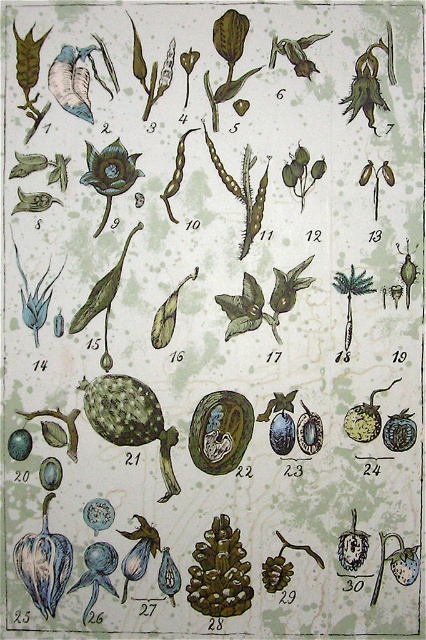
Question: Can you confirm if brown textured pine cone at center is positioned below matte green flower at upper left?

Choices:
 (A) no
 (B) yes

Answer: (B)

Question: Does brown textured pine cone at center appear on the right side of matte green flower at upper left?

Choices:
 (A) yes
 (B) no

Answer: (A)

Question: Is brown textured pine cone at center positioned behind matte green flower at upper left?

Choices:
 (A) yes
 (B) no

Answer: (A)